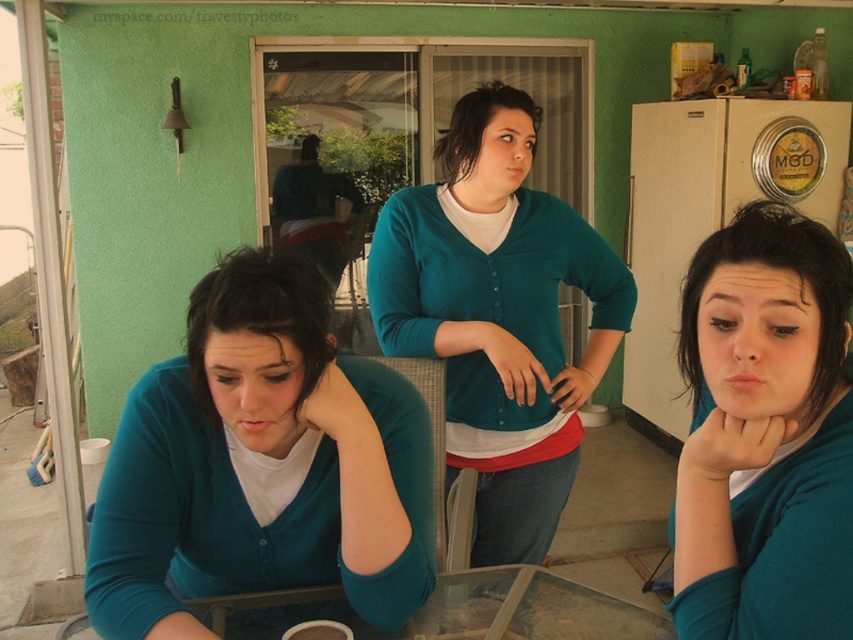
Question: Is teal cardigan at center to the left of transparent glass table at center from the viewer's perspective?

Choices:
 (A) yes
 (B) no

Answer: (A)

Question: In this image, where is teal matte cardigan at center located relative to transparent glass table at center?

Choices:
 (A) below
 (B) above

Answer: (B)

Question: Estimate the real-world distances between objects in this image. Which object is closer to the teal cardigan at center?

Choices:
 (A) transparent glass table at center
 (B) matte teal sweater at center
 (C) teal matte cardigan at center

Answer: (A)

Question: Is teal cardigan at center positioned behind teal matte cardigan at center?

Choices:
 (A) no
 (B) yes

Answer: (A)

Question: Which object is positioned closest to the teal matte cardigan at center?

Choices:
 (A) transparent glass table at center
 (B) teal cardigan at center

Answer: (A)

Question: Which object appears farthest from the camera in this image?

Choices:
 (A) matte teal sweater at center
 (B) transparent glass table at center
 (C) teal cardigan at center
 (D) teal matte cardigan at center

Answer: (D)